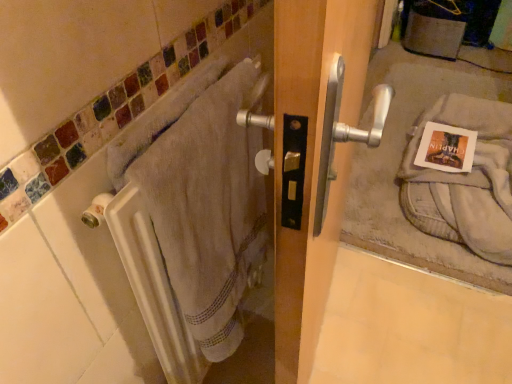
Image resolution: width=512 pixels, height=384 pixels. What are the coordinates of `matte paper postcard at door handle` in the screenshot? It's located at (446, 148).

Image resolution: width=512 pixels, height=384 pixels. What do you see at coordinates (464, 180) in the screenshot? I see `gray cotton towel at lower right, placed as the 2th bath towel when sorted from left to right` at bounding box center [464, 180].

In order to face white towel at left, should I rotate leftwards or rightwards?

Turn left by 3.145 degrees to look at white towel at left.

Identify the location of matte paper postcard at door handle. (446, 148).

In the scene shown: Which of these two, beige cotton towel at left, marked as the second bath towel in a back-to-front arrangement, or white towel at left, is wider?

Wider between the two is beige cotton towel at left, marked as the second bath towel in a back-to-front arrangement.

From a real-world perspective, which object rests below the other?

In real-world perspective, beige cotton towel at left, acting as the second bath towel starting from the right, is lower.

From the image's perspective, between beige cotton towel at left, marked as the second bath towel in a back-to-front arrangement, and white towel at left, who is located below?

white towel at left appears lower in the image.

Consider the image. Is beige cotton towel at left, arranged as the first bath towel when viewed from the left, not near white towel at left?

beige cotton towel at left, arranged as the first bath towel when viewed from the left, is actually quite close to white towel at left.

Between matte paper postcard at door handle and white towel at left, which one has less height?

matte paper postcard at door handle.

From a real-world perspective, is matte paper postcard at door handle physically below white towel at left?

Yes, from a real-world perspective, matte paper postcard at door handle is under white towel at left.

Which is behind, point (457, 138) or point (167, 24)?

Positioned behind is point (457, 138).

Is matte paper postcard at door handle turned away from white towel at left?

That's not correct — matte paper postcard at door handle is not looking away from white towel at left.

Is matte paper postcard at door handle oriented towards gray cotton towel at lower right, the 1th bath towel from the back?

Yes, matte paper postcard at door handle is aimed at gray cotton towel at lower right, the 1th bath towel from the back.

Relative to gray cotton towel at lower right, the 1th bath towel from the back, is matte paper postcard at door handle in front or behind?

In the image, matte paper postcard at door handle appears behind gray cotton towel at lower right, the 1th bath towel from the back.

From a real-world perspective, relative to gray cotton towel at lower right, which is the first bath towel from right to left, is matte paper postcard at door handle vertically above or below?

matte paper postcard at door handle is above gray cotton towel at lower right, which is the first bath towel from right to left.

From the image's perspective, is matte paper postcard at door handle on gray cotton towel at lower right, which is the first bath towel from right to left?

Incorrect, from the image's perspective, matte paper postcard at door handle is lower than gray cotton towel at lower right, which is the first bath towel from right to left.

Could gray cotton towel at lower right, which is the 2th bath towel from front to back, be considered to be inside white towel at left?

Definitely not — gray cotton towel at lower right, which is the 2th bath towel from front to back, is not inside white towel at left.

Is there a large distance between white towel at left and gray cotton towel at lower right, which is the first bath towel from right to left?

→ Absolutely, white towel at left is distant from gray cotton towel at lower right, which is the first bath towel from right to left.

From a real-world perspective, which object stands above the other?

white towel at left.

Find the location of a particular element. The height and width of the screenshot is (384, 512). bath located in front of the gray cotton towel at lower right, the 1th bath towel from the back is located at coordinates (69, 290).

Is gray cotton towel at lower right, which is the first bath towel from right to left, to the left or to the right of beige cotton towel at left, acting as the second bath towel starting from the right, in the image?

From the image, it's evident that gray cotton towel at lower right, which is the first bath towel from right to left, is to the right of beige cotton towel at left, acting as the second bath towel starting from the right.

Is there a large distance between gray cotton towel at lower right, the 1th bath towel from the back, and beige cotton towel at left, marked as the second bath towel in a back-to-front arrangement?

Yes, gray cotton towel at lower right, the 1th bath towel from the back, is far from beige cotton towel at left, marked as the second bath towel in a back-to-front arrangement.

Which object is further away from the camera, gray cotton towel at lower right, the 1th bath towel from the back, or beige cotton towel at left, arranged as the first bath towel when viewed from the left?

gray cotton towel at lower right, the 1th bath towel from the back, is behind.

Between gray cotton towel at lower right, which is the 2th bath towel from front to back, and beige cotton towel at left, marked as the second bath towel in a back-to-front arrangement, which one has smaller size?

beige cotton towel at left, marked as the second bath towel in a back-to-front arrangement.

Is white towel at left located outside beige cotton towel at left, marked as the second bath towel in a back-to-front arrangement?

Actually, white towel at left is within beige cotton towel at left, marked as the second bath towel in a back-to-front arrangement.

From the image's perspective, would you say white towel at left is positioned over beige cotton towel at left, acting as the second bath towel starting from the right?

No.

Identify the location of bath on the left of beige cotton towel at left, acting as the second bath towel starting from the right. (69, 290).

Between white towel at left and beige cotton towel at left, marked as the second bath towel in a back-to-front arrangement, which one has less height?

beige cotton towel at left, marked as the second bath towel in a back-to-front arrangement.

From the image's perspective, between matte paper postcard at door handle and beige cotton towel at left, marked as the second bath towel in a back-to-front arrangement, who is located below?

beige cotton towel at left, marked as the second bath towel in a back-to-front arrangement, from the image's perspective.

From a real-world perspective, which object stands above the other?

beige cotton towel at left, which is the first bath towel from front to back.

Between matte paper postcard at door handle and beige cotton towel at left, which is the first bath towel from front to back, which one has more height?

beige cotton towel at left, which is the first bath towel from front to back.

Identify the location of postcard below the beige cotton towel at left, marked as the second bath towel in a back-to-front arrangement (from a real-world perspective). (446, 148).

You are a GUI agent. You are given a task and a screenshot of the screen. Output one action in this format:
    pyautogui.click(x=<x>, y=<y>)
    Task: Click on the 1st bath towel below the white towel at left (from a real-world perspective)
    This screenshot has width=512, height=384.
    Given the screenshot: What is the action you would take?
    pyautogui.click(x=206, y=204)

There is a matte paper postcard at door handle. At what (x,y) coordinates should I click in order to perform the action: click on bath above it (from a real-world perspective). Please return your answer as a coordinate pair (x, y). Looking at the image, I should click on (69, 290).

Looking at the image, which one is located closer to white towel at left, matte paper postcard at door handle or gray cotton towel at lower right, placed as the 2th bath towel when sorted from left to right?

Among the two, gray cotton towel at lower right, placed as the 2th bath towel when sorted from left to right, is located nearer to white towel at left.

Based on their spatial positions, is white towel at left or matte paper postcard at door handle closer to gray cotton towel at lower right, the 1th bath towel from the back?

matte paper postcard at door handle lies closer to gray cotton towel at lower right, the 1th bath towel from the back, than the other object.

Which object lies nearer to the anchor point beige cotton towel at left, marked as the second bath towel in a back-to-front arrangement, gray cotton towel at lower right, the 1th bath towel from the back, or matte paper postcard at door handle?

gray cotton towel at lower right, the 1th bath towel from the back, is closer to beige cotton towel at left, marked as the second bath towel in a back-to-front arrangement.

Considering their positions, is beige cotton towel at left, marked as the second bath towel in a back-to-front arrangement, positioned closer to matte paper postcard at door handle than white towel at left?

Based on the image, beige cotton towel at left, marked as the second bath towel in a back-to-front arrangement, appears to be nearer to matte paper postcard at door handle.

From the image, which object appears to be farther from white towel at left, gray cotton towel at lower right, the 1th bath towel from the back, or matte paper postcard at door handle?

Based on the image, matte paper postcard at door handle appears to be further to white towel at left.

Considering their positions, is matte paper postcard at door handle positioned closer to gray cotton towel at lower right, the 1th bath towel from the back, than white towel at left?

Among the two, matte paper postcard at door handle is located nearer to gray cotton towel at lower right, the 1th bath towel from the back.

From the image, which object appears to be farther from matte paper postcard at door handle, white towel at left or gray cotton towel at lower right, which is the 2th bath towel from front to back?

Among the two, white towel at left is located further to matte paper postcard at door handle.

Estimate the real-world distances between objects in this image. Which object is closer to white towel at left, matte paper postcard at door handle or beige cotton towel at left, acting as the second bath towel starting from the right?

The object closer to white towel at left is beige cotton towel at left, acting as the second bath towel starting from the right.

At what (x,y) coordinates should I click in order to perform the action: click on postcard between beige cotton towel at left, arranged as the first bath towel when viewed from the left, and gray cotton towel at lower right, the 1th bath towel from the back, in the horizontal direction. Please return your answer as a coordinate pair (x, y). This screenshot has width=512, height=384. Looking at the image, I should click on (446, 148).

Locate an element on the screen. This screenshot has width=512, height=384. bath towel located between white towel at left and gray cotton towel at lower right, which is the 2th bath towel from front to back, in the left-right direction is located at coordinates (206, 204).